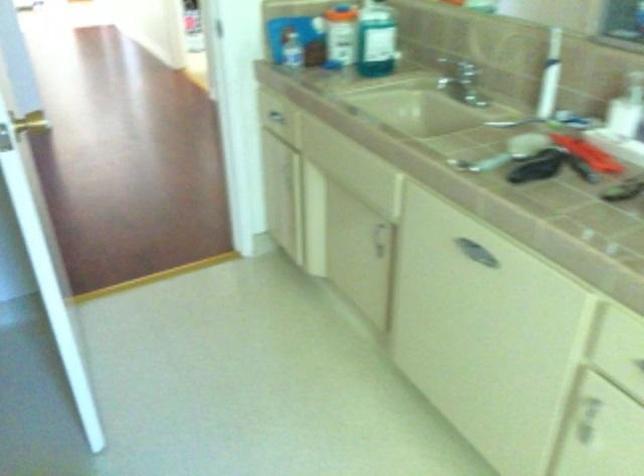
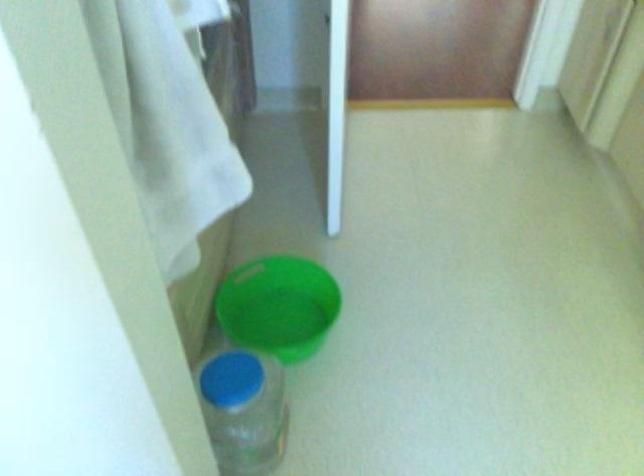
First-person continuous shooting, in which direction is the camera rotating?

The camera rotated toward left-down.